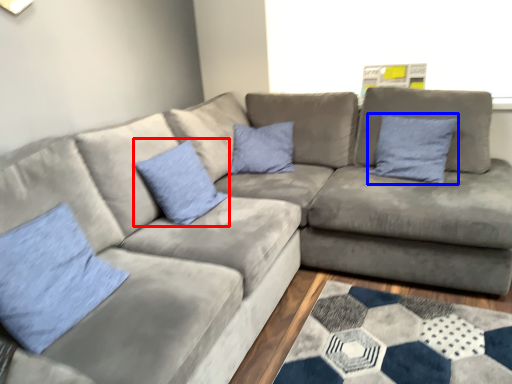
Question: Which of the following is the farthest to the observer, pillow (highlighted by a red box) or pillow (highlighted by a blue box)?

Choices:
 (A) pillow
 (B) pillow

Answer: (B)